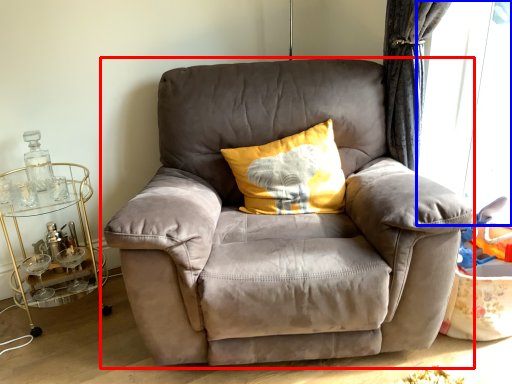
Question: Which object appears closest to the camera in this image, chair (highlighted by a red box) or window screen (highlighted by a blue box)?

Choices:
 (A) chair
 (B) window screen

Answer: (A)